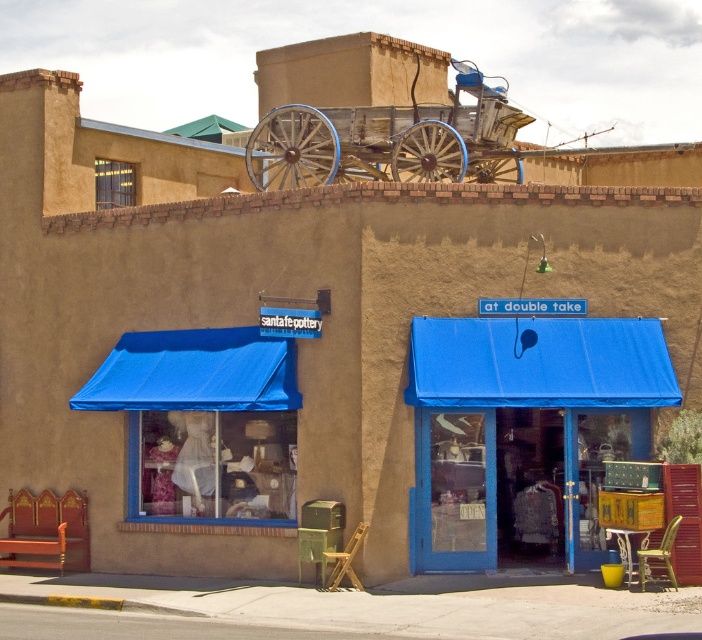
Based on the photo, who is lower down, blue fabric awning at center or weathered wood cart at upper center?

blue fabric awning at center is below.

Does blue fabric awning at center lie in front of weathered wood cart at upper center?

Yes, blue fabric awning at center is closer to the viewer.

Does point (470, 374) lie behind point (310, 136)?

No, (470, 374) is in front of (310, 136).

The height and width of the screenshot is (640, 702). What are the coordinates of `blue fabric awning at center` in the screenshot? It's located at (524, 433).